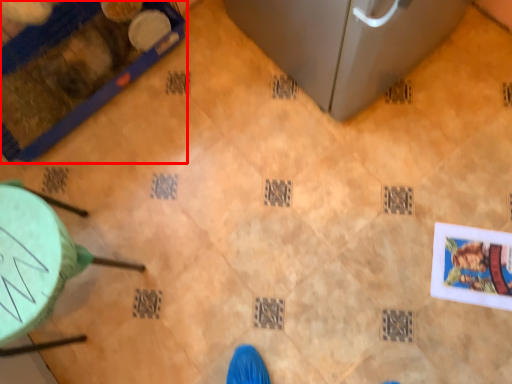
Question: From the image's perspective, what is the correct spatial positioning of furniture (annotated by the red box) in reference to furniture?

Choices:
 (A) below
 (B) above

Answer: (B)